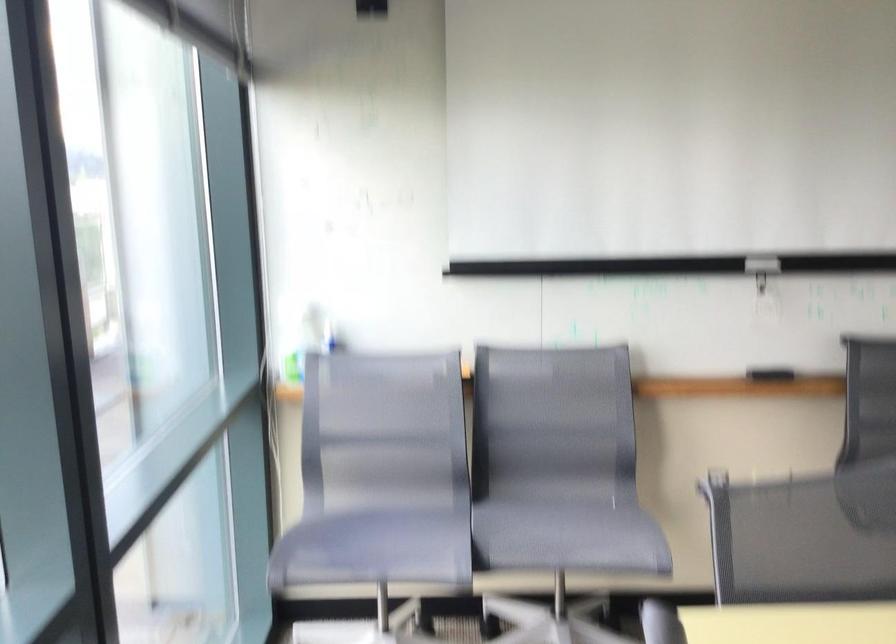
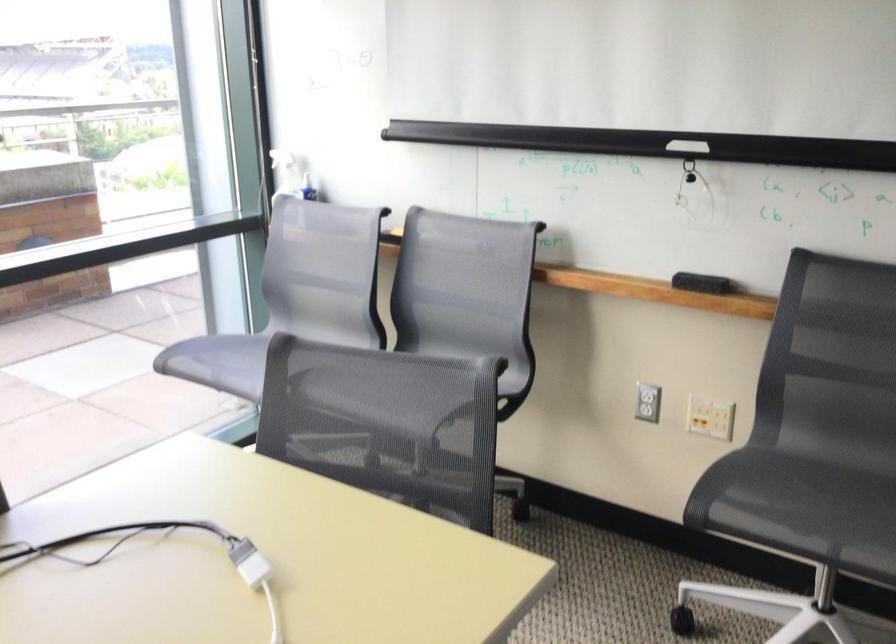
In the second image, find the point that corresponds to (297,325) in the first image.

(287, 174)